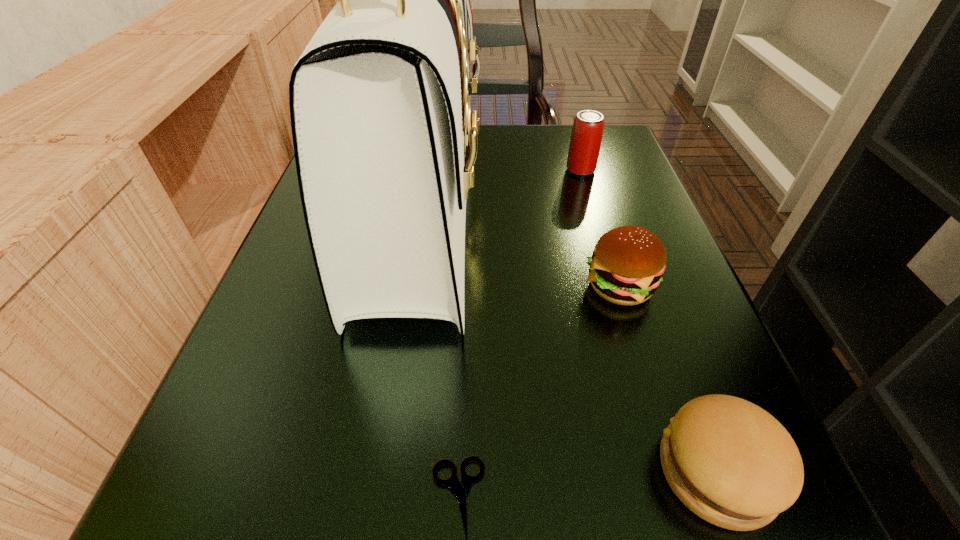
Image resolution: width=960 pixels, height=540 pixels. Find the location of `satchel at the far edge`. satchel at the far edge is located at coordinates (385, 142).

I want to click on beer can that is at the far edge, so click(x=586, y=137).

Where is `object positioned at the near edge`? Image resolution: width=960 pixels, height=540 pixels. object positioned at the near edge is located at coordinates (729, 461).

Where is `object present at the left edge`? The width and height of the screenshot is (960, 540). object present at the left edge is located at coordinates click(x=385, y=142).

Find the location of a particular element. This screenshot has height=540, width=960. beer can at the right edge is located at coordinates (586, 137).

Locate an element on the screen. Image resolution: width=960 pixels, height=540 pixels. object at the far left corner is located at coordinates (385, 142).

Where is `object at the far right corner`? This screenshot has height=540, width=960. object at the far right corner is located at coordinates (586, 137).

Where is `object located at the near right corner`? Image resolution: width=960 pixels, height=540 pixels. object located at the near right corner is located at coordinates (729, 461).

Identify the location of vacant position at the far edge of the desktop. The width and height of the screenshot is (960, 540). (520, 132).

The image size is (960, 540). I want to click on vacant space at the left edge of the desktop, so click(x=276, y=328).